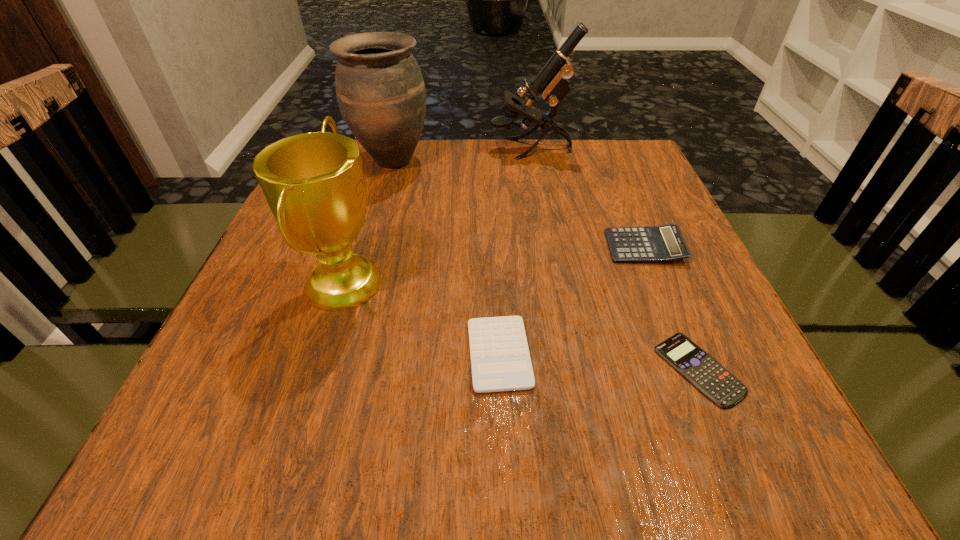
Locate an element on the screen. The height and width of the screenshot is (540, 960). vacant area situated 0.290m through the eyepiece of the microscope is located at coordinates [x=383, y=149].

Locate an element on the screen. The image size is (960, 540). free spot located 0.080m on the left of the urn is located at coordinates (322, 160).

What are the coordinates of `vacant area situated on the shiny surface of the award` in the screenshot? It's located at (423, 281).

Locate an element on the screen. This screenshot has width=960, height=540. free space located 0.340m on the left of the farthest calculator is located at coordinates (440, 247).

At what (x,y) coordinates should I click in order to perform the action: click on vacant region located 0.160m on the right of the leftmost calculator. Please return your answer as a coordinate pair (x, y). This screenshot has width=960, height=540. Looking at the image, I should click on (632, 354).

What are the coordinates of `vacant space situated 0.060m on the front of the shortest calculator` in the screenshot? It's located at (732, 450).

Where is `microscope present at the far edge`? microscope present at the far edge is located at coordinates (552, 80).

Locate an element on the screen. The image size is (960, 540). urn located at the far edge is located at coordinates (381, 94).

The image size is (960, 540). In order to click on urn that is at the left edge in this screenshot , I will do `click(381, 94)`.

At what (x,y) coordinates should I click in order to perform the action: click on award at the left edge. Please return your answer as a coordinate pair (x, y). Looking at the image, I should click on (314, 184).